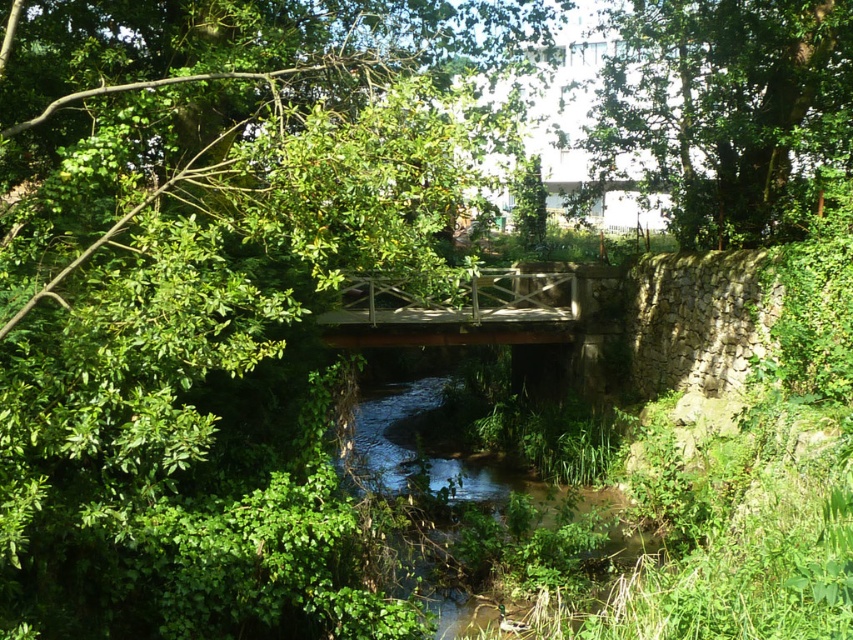
Question: Can you confirm if green leafy tree at center is thinner than green leafy tree at upper center?

Choices:
 (A) no
 (B) yes

Answer: (A)

Question: Is the position of green leafy tree at center more distant than that of green leafy tree at upper center?

Choices:
 (A) yes
 (B) no

Answer: (B)

Question: Can you confirm if green leafy tree at center is positioned to the left of green leafy tree at upper center?

Choices:
 (A) no
 (B) yes

Answer: (B)

Question: Which point appears closest to the camera in this image?

Choices:
 (A) (360, 292)
 (B) (107, 394)
 (C) (733, 115)

Answer: (B)

Question: Which of the following is the farthest from the observer?

Choices:
 (A) green leafy tree at center
 (B) wooden bridge at center

Answer: (B)

Question: Estimate the real-world distances between objects in this image. Which object is closer to the wooden bridge at center?

Choices:
 (A) green leafy tree at upper center
 (B) green leafy tree at center

Answer: (B)